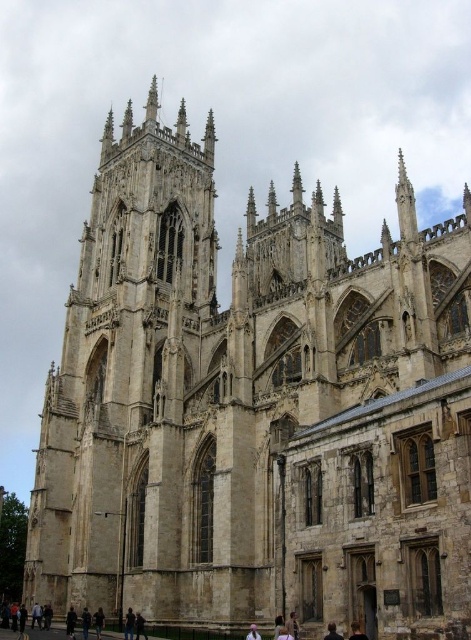
Is point (97, 616) positioned before point (358, 625)?

No.

Who is higher up, dark brown leather backpack at lower center or black hair at lower center?

black hair at lower center is above.

Who is more forward, (x=97, y=616) or (x=354, y=636)?

Point (x=354, y=636)

This screenshot has width=471, height=640. What are the coordinates of `dark brown leather backpack at lower center` in the screenshot? It's located at (98, 621).

Who is lower down, stone spire at upper center or dark brown leather backpack at lower center?

dark brown leather backpack at lower center is below.

In order to click on stone spire at upper center in this screenshot , I will do `click(152, 100)`.

Find the location of a particular element. This screenshot has height=640, width=471. stone spire at upper center is located at coordinates (152, 100).

Can you confirm if stone spire at upper center is smaller than dark brown leather jacket at lower center?

No, stone spire at upper center is not smaller than dark brown leather jacket at lower center.

Does stone spire at upper center have a lesser height compared to dark brown leather jacket at lower center?

In fact, stone spire at upper center may be taller than dark brown leather jacket at lower center.

Find the location of a particular element. Image resolution: width=471 pixels, height=640 pixels. stone spire at upper center is located at coordinates (152, 100).